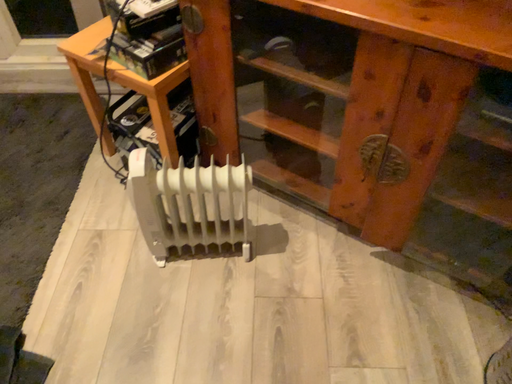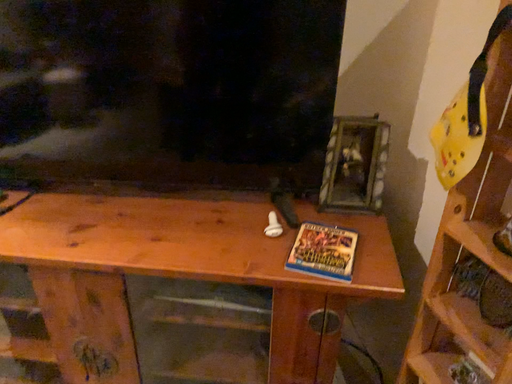
Question: How did the camera likely rotate when shooting the video?

Choices:
 (A) rotated upward
 (B) rotated downward

Answer: (A)